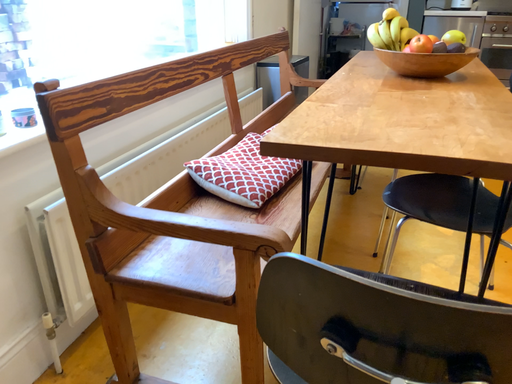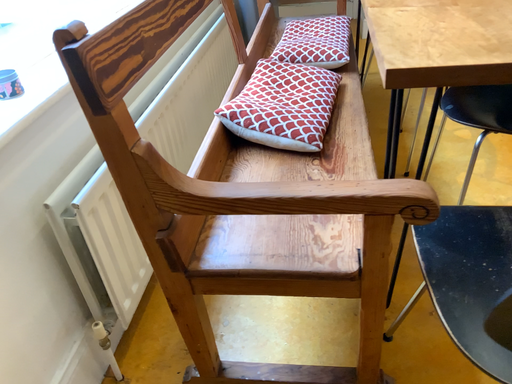
Question: Which way did the camera rotate in the video?

Choices:
 (A) rotated left
 (B) rotated right

Answer: (B)